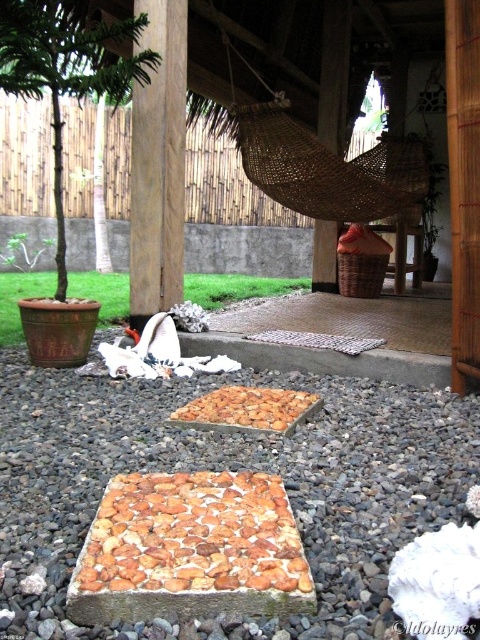
Question: Does brown gravel at center have a larger size compared to brown crumbly bread at center?

Choices:
 (A) no
 (B) yes

Answer: (B)

Question: Which point is closer to the camera?

Choices:
 (A) golden brown crumbly at center
 (B) brown gravel at center
 (C) brown crumbly bread at center

Answer: (B)

Question: Does brown wood post at center have a lesser width compared to golden brown crumbly at center?

Choices:
 (A) no
 (B) yes

Answer: (B)

Question: Which of the following is the closest to the observer?

Choices:
 (A) (337, 211)
 (B) (173, 51)
 (C) (181, 577)

Answer: (C)

Question: Is woven brown hammock at upper center thinner than golden brown crumbly at center?

Choices:
 (A) no
 (B) yes

Answer: (A)

Question: Which point is farther to the camera?

Choices:
 (A) (169, 458)
 (B) (181, 506)
 (C) (180, 195)

Answer: (C)